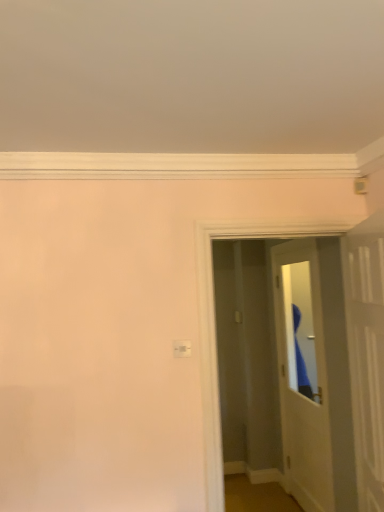
Question: From the image's perspective, relative to white glossy door at center, positioned as the first door in back-to-front order, is white glossy door at upper right, which is the 2th door in back-to-front order, above or below?

Choices:
 (A) below
 (B) above

Answer: (B)

Question: Is point (377, 395) positioned closer to the camera than point (322, 428)?

Choices:
 (A) closer
 (B) farther

Answer: (A)

Question: In the image, is white glossy door at upper right, the 1th door viewed from the front, positioned in front of or behind white glossy door at center, positioned as the first door in back-to-front order?

Choices:
 (A) front
 (B) behind

Answer: (A)

Question: Considering the relative positions of white glossy door at center, positioned as the first door in back-to-front order, and white glossy door at upper right, which is the 2th door in back-to-front order, in the image provided, is white glossy door at center, positioned as the first door in back-to-front order, to the left or to the right of white glossy door at upper right, which is the 2th door in back-to-front order,?

Choices:
 (A) right
 (B) left

Answer: (A)

Question: In terms of height, does white glossy door at center, positioned as the first door in back-to-front order, look taller or shorter compared to white glossy door at upper right, the 1th door viewed from the front?

Choices:
 (A) tall
 (B) short

Answer: (A)

Question: From the image's perspective, relative to white glossy door at upper right, the 1th door viewed from the front, is white glossy door at center, positioned as the first door in back-to-front order, above or below?

Choices:
 (A) above
 (B) below

Answer: (B)

Question: In the image, is white glossy door at center, positioned as the first door in back-to-front order, positioned in front of or behind white glossy door at upper right, which is the 2th door in back-to-front order?

Choices:
 (A) front
 (B) behind

Answer: (B)